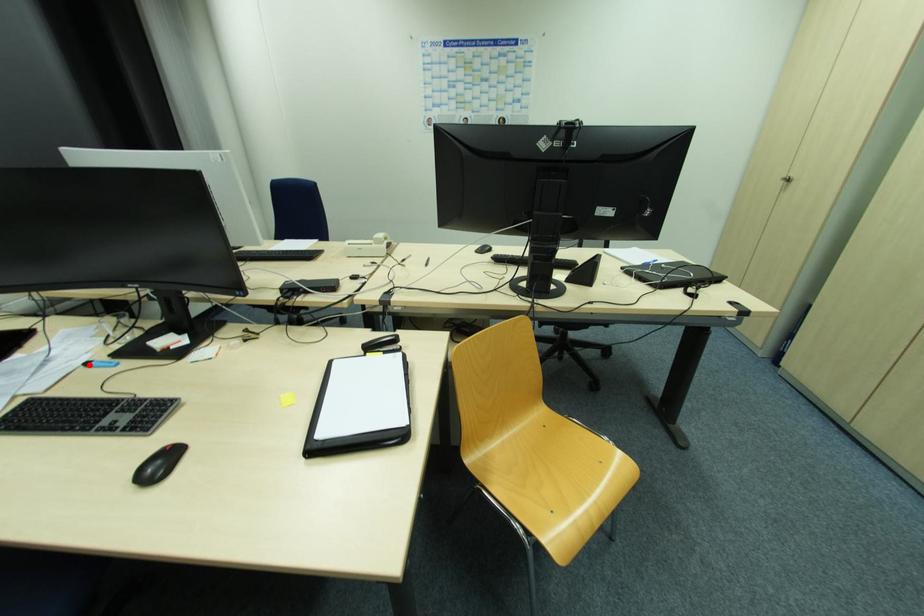
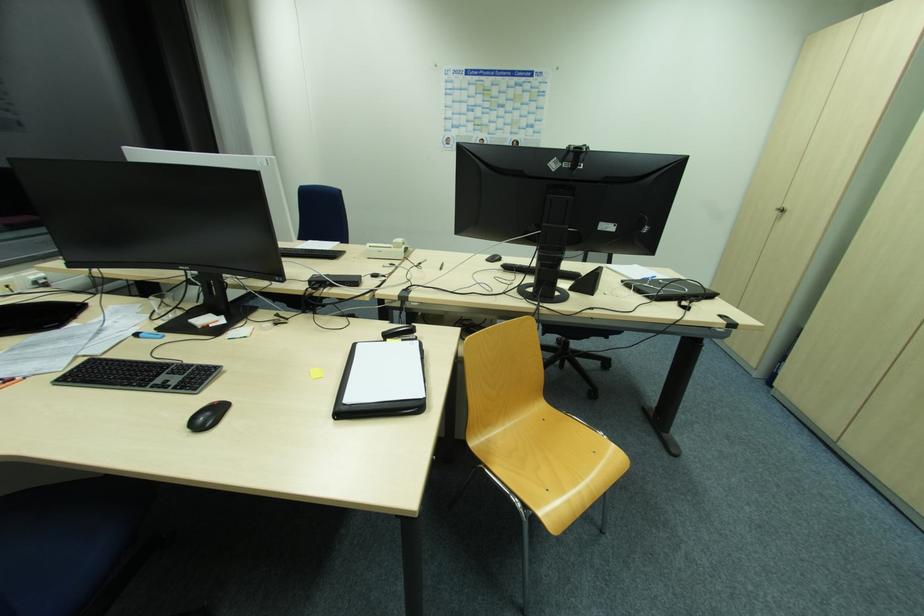
Where in the second image is the point corresponding to the highlighted location from the first image?

(139, 334)